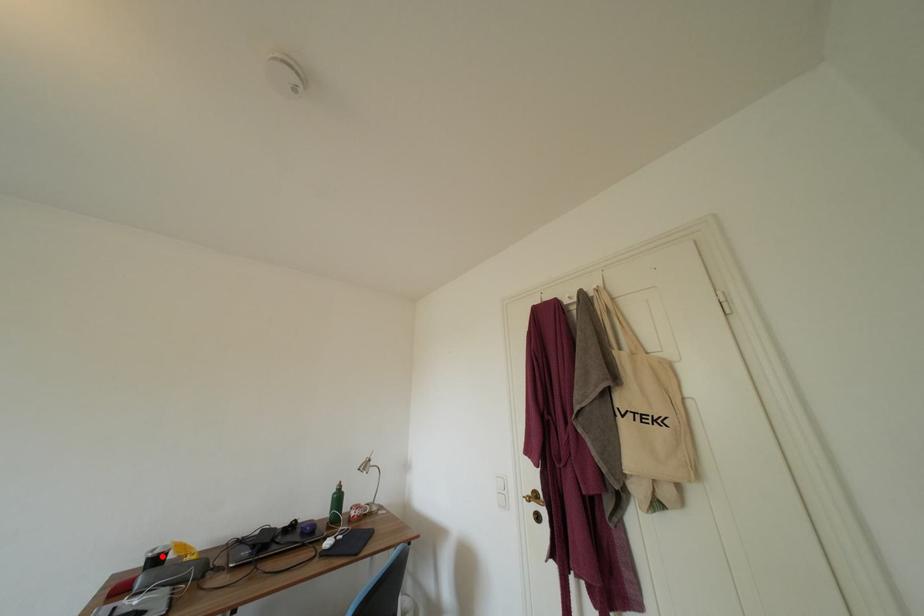
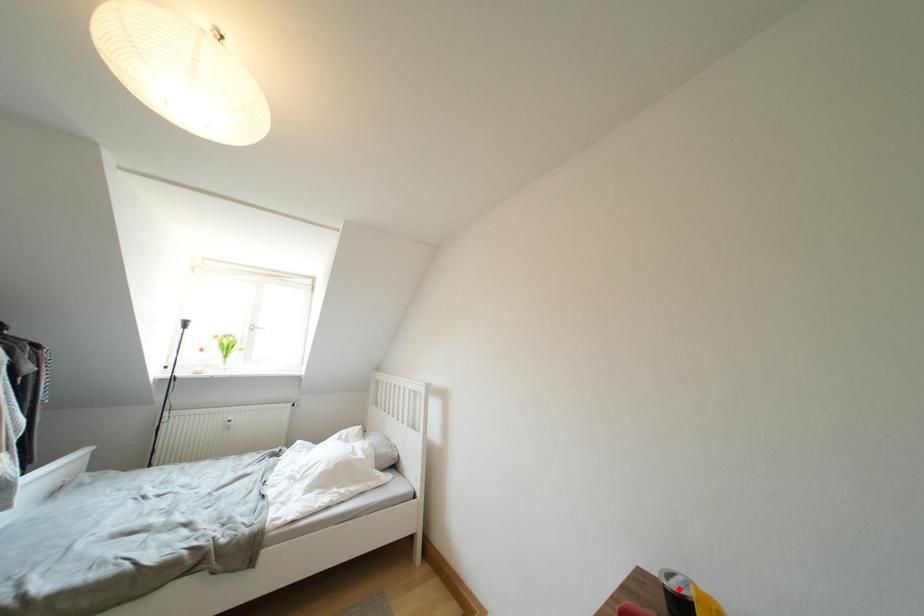
I am providing you with two images of the same scene from different viewpoints. A red point is marked on the first image and another point is marked on the second image. Is the marked point in image1 the same physical position as the marked point in image2?

Yes